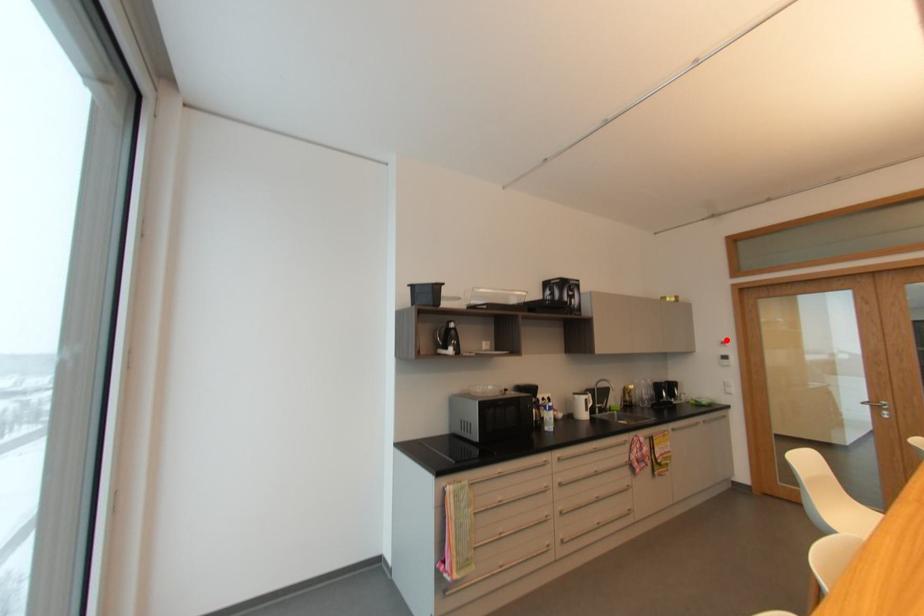
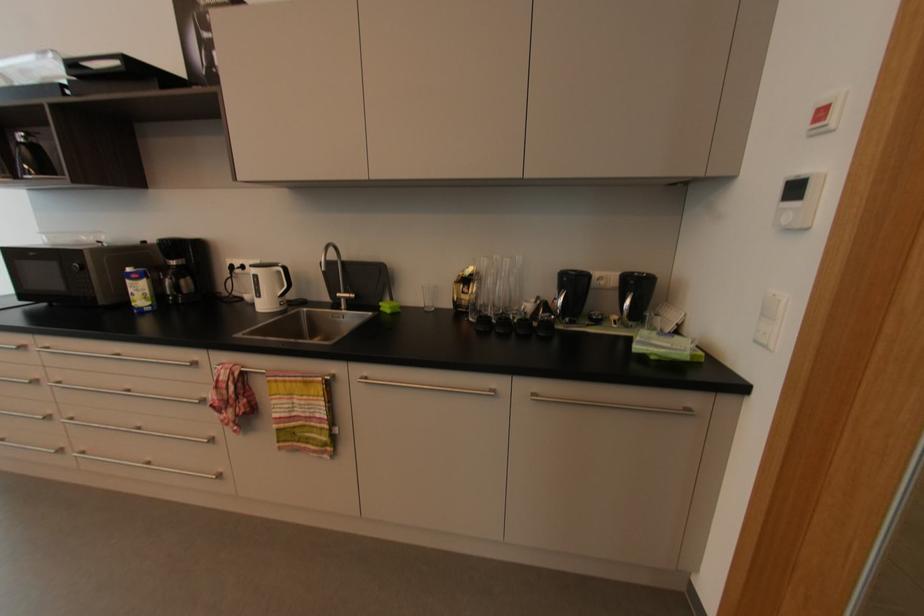
Find the pixel in the second image that matches the highlighted location in the first image.

(832, 99)